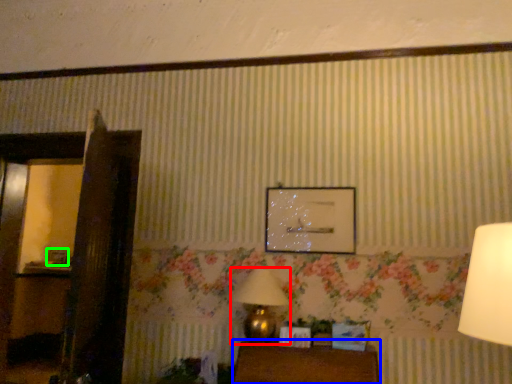
Question: Estimate the real-world distances between objects in this image. Which object is farther from table lamp (highlighted by a red box), furniture (highlighted by a blue box) or picture frame (highlighted by a green box)?

Choices:
 (A) furniture
 (B) picture frame

Answer: (B)